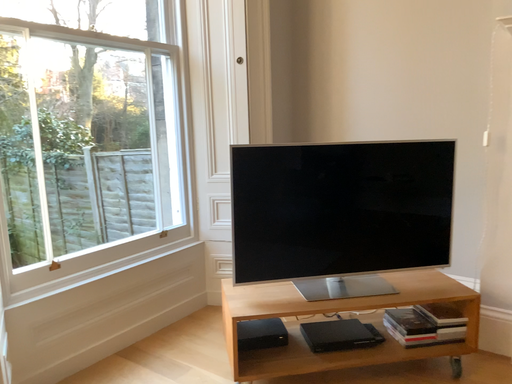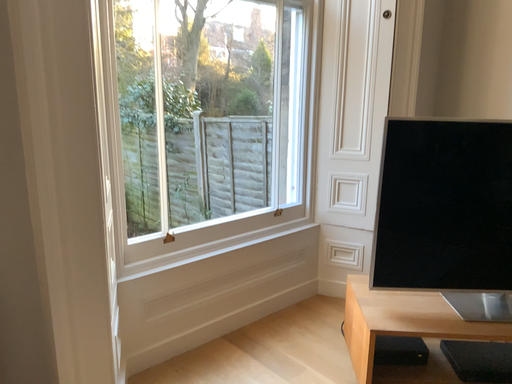
Question: How did the camera likely rotate when shooting the video?

Choices:
 (A) rotated right
 (B) rotated left

Answer: (B)